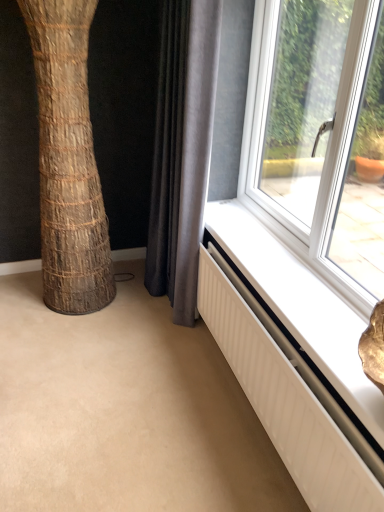
This screenshot has height=512, width=384. Describe the element at coordinates (289, 397) in the screenshot. I see `white textured radiator at lower right` at that location.

Locate an element on the screen. This screenshot has width=384, height=512. white textured radiator at lower right is located at coordinates pyautogui.click(x=289, y=397).

From a real-world perspective, is white textured radiator at lower right physically above gray fabric curtain at lower center?

No.

From the image's perspective, is white textured radiator at lower right below gray fabric curtain at lower center?

Indeed, from the image's perspective, white textured radiator at lower right is shown beneath gray fabric curtain at lower center.

There is a white textured radiator at lower right. Identify the location of curtain above it (from a real-world perspective). (182, 150).

Which is more to the left, white textured radiator at lower right or gray fabric curtain at lower center?

From the viewer's perspective, gray fabric curtain at lower center appears more on the left side.

Based on their sizes in the image, would you say brown textured tree trunk at left is bigger or smaller than white textured radiator at lower right?

Clearly, brown textured tree trunk at left is larger in size than white textured radiator at lower right.

Relative to white textured radiator at lower right, is brown textured tree trunk at left in front or behind?

In the image, brown textured tree trunk at left appears behind white textured radiator at lower right.

Considering the sizes of objects brown textured tree trunk at left and white textured radiator at lower right in the image provided, who is wider, brown textured tree trunk at left or white textured radiator at lower right?

With larger width is brown textured tree trunk at left.

How different are the orientations of brown textured tree trunk at left and white textured radiator at lower right in degrees?

They differ by 89.2 degrees in their facing directions.

Could you tell me if gray fabric curtain at lower center is turned towards white textured radiator at lower right?

No.

What's the angular difference between gray fabric curtain at lower center and white textured radiator at lower right's facing directions?

They differ by 0.00131 degrees in their facing directions.

Is point (203, 113) in front of point (232, 272)?

Yes, it is in front of point (232, 272).

Can you confirm if gray fabric curtain at lower center is bigger than white textured radiator at lower right?

Correct, gray fabric curtain at lower center is larger in size than white textured radiator at lower right.

Considering their positions, is white textured radiator at lower right located in front of or behind brown textured tree trunk at left?

white textured radiator at lower right is in front of brown textured tree trunk at left.

How different are the orientations of white textured radiator at lower right and brown textured tree trunk at left in degrees?

The angle between the facing direction of white textured radiator at lower right and the facing direction of brown textured tree trunk at left is 89.2 degrees.

Identify the location of tree trunk that is above the white textured radiator at lower right (from the image's perspective). This screenshot has height=512, width=384. (68, 160).

Based on their sizes in the image, would you say white textured radiator at lower right is bigger or smaller than brown textured tree trunk at left?

Considering their sizes, white textured radiator at lower right takes up less space than brown textured tree trunk at left.

Which is more to the right, gray fabric curtain at lower center or brown textured tree trunk at left?

gray fabric curtain at lower center.

Is gray fabric curtain at lower center thinner than brown textured tree trunk at left?

Yes.

Consider the image. Who is bigger, gray fabric curtain at lower center or brown textured tree trunk at left?

Bigger between the two is brown textured tree trunk at left.

From their relative heights in the image, would you say brown textured tree trunk at left is taller or shorter than gray fabric curtain at lower center?

In the image, brown textured tree trunk at left appears to be shorter than gray fabric curtain at lower center.

Which point is more forward, (71, 157) or (198, 202)?

The point (198, 202) is closer.

Is brown textured tree trunk at left to the left or to the right of gray fabric curtain at lower center in the image?

Based on their positions, brown textured tree trunk at left is located to the left of gray fabric curtain at lower center.

From the image's perspective, does brown textured tree trunk at left appear higher than gray fabric curtain at lower center?

No, from the image's perspective, brown textured tree trunk at left is not on top of gray fabric curtain at lower center.

Where is `curtain on the left of the white textured radiator at lower right`? The height and width of the screenshot is (512, 384). curtain on the left of the white textured radiator at lower right is located at coordinates (182, 150).

What are the coordinates of `radiator that appears below the brown textured tree trunk at left (from the image's perspective)` in the screenshot? It's located at (289, 397).

Considering their positions, is white textured radiator at lower right positioned closer to brown textured tree trunk at left than gray fabric curtain at lower center?

Among the two, gray fabric curtain at lower center is located nearer to brown textured tree trunk at left.

Based on their spatial positions, is gray fabric curtain at lower center or brown textured tree trunk at left further from white textured radiator at lower right?

Among the two, brown textured tree trunk at left is located further to white textured radiator at lower right.

When comparing their distances from gray fabric curtain at lower center, does white textured radiator at lower right or brown textured tree trunk at left seem further?

white textured radiator at lower right is positioned further to the anchor gray fabric curtain at lower center.

Looking at the image, which one is located closer to gray fabric curtain at lower center, brown textured tree trunk at left or white textured radiator at lower right?

Based on the image, brown textured tree trunk at left appears to be nearer to gray fabric curtain at lower center.

From the picture: From the image, which object appears to be nearer to white textured radiator at lower right, brown textured tree trunk at left or gray fabric curtain at lower center?

gray fabric curtain at lower center lies closer to white textured radiator at lower right than the other object.

Considering their positions, is gray fabric curtain at lower center positioned closer to brown textured tree trunk at left than white textured radiator at lower right?

gray fabric curtain at lower center.

Identify the location of tree trunk between gray fabric curtain at lower center and white textured radiator at lower right in the vertical direction. (68, 160).